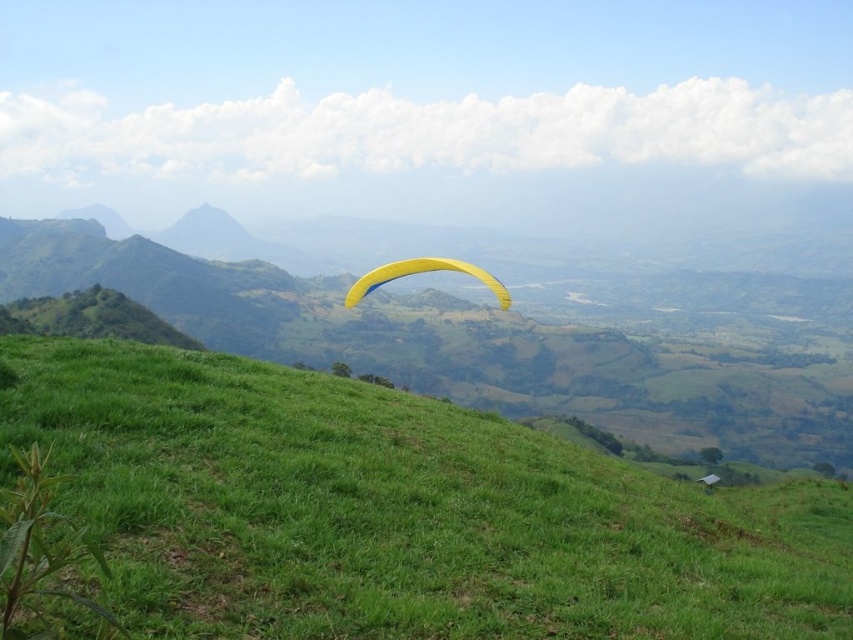
Question: Can you confirm if green grassy hillside at lower center is bigger than yellow fabric parachute at center?

Choices:
 (A) yes
 (B) no

Answer: (B)

Question: Which of the following is the farthest from the observer?

Choices:
 (A) (751, 604)
 (B) (358, 298)

Answer: (B)

Question: Can you confirm if green grassy hillside at lower center is positioned to the right of yellow fabric parachute at center?

Choices:
 (A) yes
 (B) no

Answer: (A)

Question: Is green grassy hillside at lower center thinner than yellow fabric parachute at center?

Choices:
 (A) no
 (B) yes

Answer: (A)

Question: Which object appears closest to the camera in this image?

Choices:
 (A) yellow fabric parachute at center
 (B) green grassy hillside at lower center

Answer: (B)